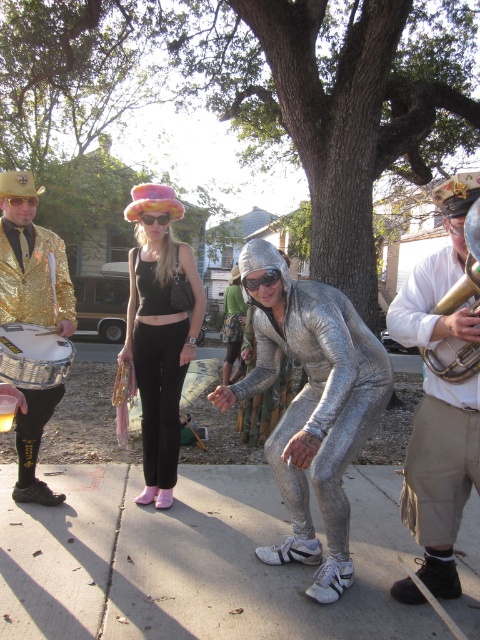
Question: Is concrete sidewalk at center closer to camera compared to shiny metallic suit at center?

Choices:
 (A) yes
 (B) no

Answer: (A)

Question: Is gold metallic jacket at left positioned at the back of brushed silver drum at left?

Choices:
 (A) yes
 (B) no

Answer: (A)

Question: Among these points, which one is farthest from the camera?

Choices:
 (A) (41, 353)
 (B) (4, 316)
 (C) (463, 376)

Answer: (B)

Question: Which point is farther to the camera?

Choices:
 (A) (23, 276)
 (B) (196, 332)

Answer: (B)

Question: Is concrete sidewalk at center to the left of brushed silver drum at left from the viewer's perspective?

Choices:
 (A) yes
 (B) no

Answer: (B)

Question: Based on their relative distances, which object is farther from the gold brass trumpet at upper right?

Choices:
 (A) gold metallic jacket at left
 (B) shiny silver suit at center
 (C) pink fur hat at center

Answer: (A)